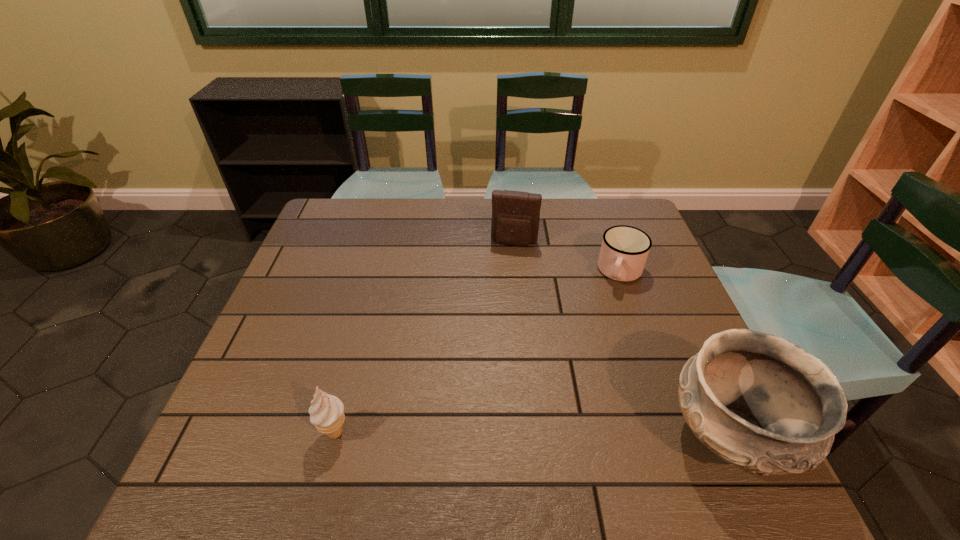
In the image, there is a desktop. Identify the location of vacant space at the far edge. Image resolution: width=960 pixels, height=540 pixels. (484, 221).

Locate an element on the screen. vacant area at the near edge of the desktop is located at coordinates (397, 435).

Find the location of `free space at the left edge`. free space at the left edge is located at coordinates (287, 371).

Identify the location of vacant space at the right edge of the desktop. The height and width of the screenshot is (540, 960). [x=646, y=323].

Locate an element on the screen. The height and width of the screenshot is (540, 960). blank space at the far left corner is located at coordinates (353, 219).

Find the location of a particular element. Image resolution: width=960 pixels, height=540 pixels. unoccupied position between the third nearest object and the pottery is located at coordinates click(x=675, y=354).

You are a GUI agent. You are given a task and a screenshot of the screen. Output one action in this format:
    pyautogui.click(x=<x>, y=<y>)
    Task: Click on the vacant area that lies between the pottery and the shortest object
    The width and height of the screenshot is (960, 540).
    Given the screenshot: What is the action you would take?
    pyautogui.click(x=675, y=354)

Find the location of `free spot between the pouch and the leftmost object`. free spot between the pouch and the leftmost object is located at coordinates (424, 338).

Identify the location of blank region between the second object from left to right and the icecream. (424, 338).

I want to click on vacant area that lies between the second object from left to right and the pottery, so click(x=622, y=339).